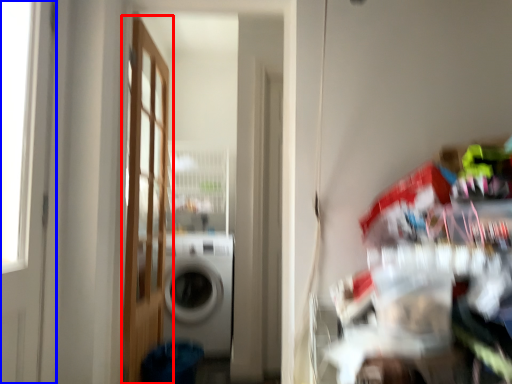
Question: Which point is further to the camera, door (highlighted by a red box) or door (highlighted by a blue box)?

Choices:
 (A) door
 (B) door

Answer: (A)